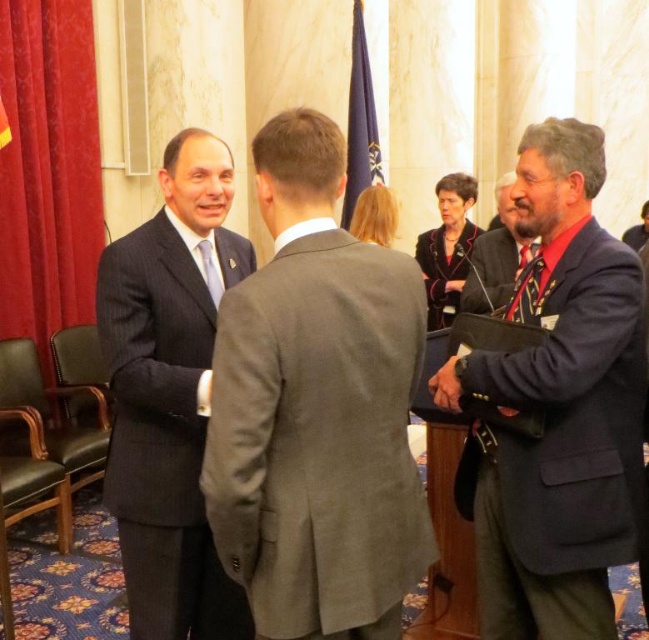
Question: Among these objects, which one is farthest from the camera?

Choices:
 (A) black wool suit at center
 (B) dark blue suit at center

Answer: (B)

Question: Among these points, which one is farthest from the camera?

Choices:
 (A) (631, 282)
 (B) (434, 252)
 (C) (533, 246)

Answer: (B)

Question: Can you confirm if dark blue wool suit at center is smaller than black wool suit at center?

Choices:
 (A) no
 (B) yes

Answer: (B)

Question: Does gray wool suit at center appear on the right side of black wool suit at center?

Choices:
 (A) no
 (B) yes

Answer: (A)

Question: Which of the following is the farthest from the observer?

Choices:
 (A) gray wool suit at center
 (B) dark blue wool suit at center

Answer: (B)

Question: Is dark blue suit at right bigger than black wool suit at center?

Choices:
 (A) yes
 (B) no

Answer: (A)